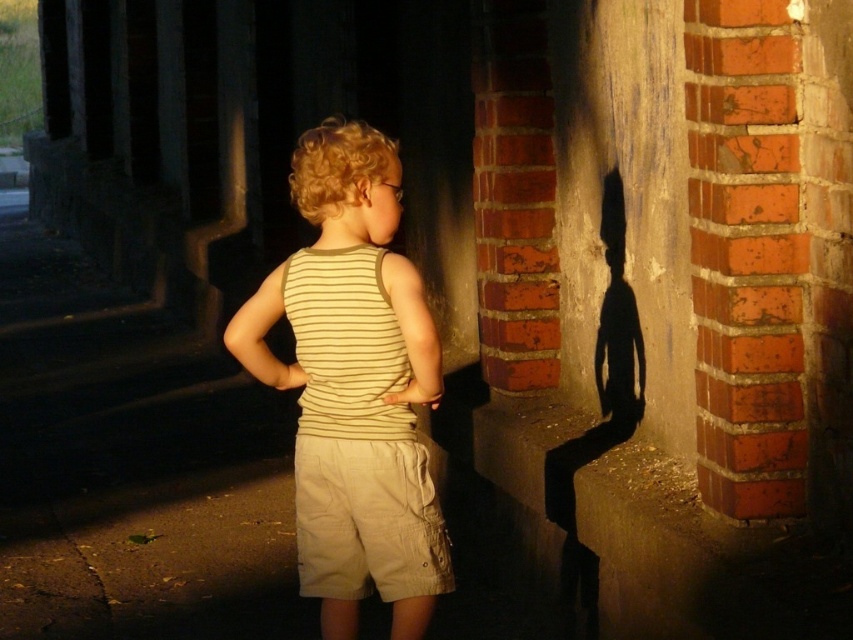
The child is wearing a striped cotton tank top at center and khaki cotton shorts at center. Which piece of clothing is closer to the camera?

The striped cotton tank top at center is in front of the khaki cotton shorts at center, so the striped cotton tank top at center is closer to the camera.

The child is wearing a striped cotton tank top at center and khaki cotton shorts at center. Which piece of clothing is positioned more to the left?

The striped cotton tank top at center is positioned to the left of the khaki cotton shorts at center.